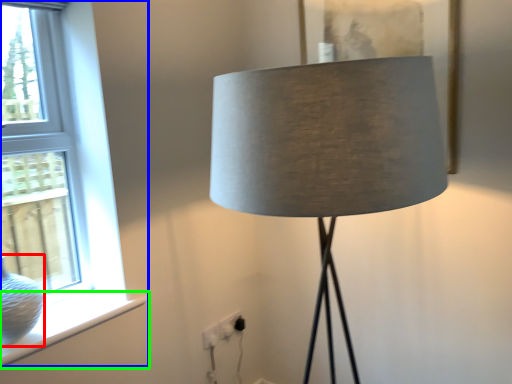
Question: Considering the real-world distances, which object is closest to glass vase (highlighted by a red box)? window (highlighted by a blue box) or window sill (highlighted by a green box).

Choices:
 (A) window
 (B) window sill

Answer: (B)